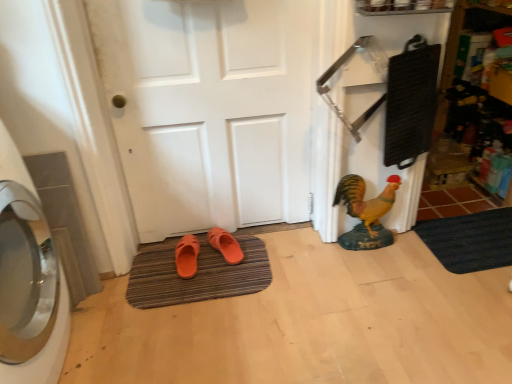
At what (x,y) coordinates should I click in order to perform the action: click on vacant space that is to the left of shiny yellow statue at right. Please return your answer as a coordinate pair (x, y). This screenshot has width=512, height=384. Looking at the image, I should click on (316, 253).